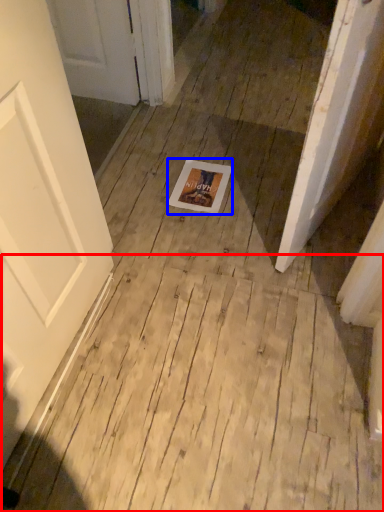
Question: Which of the following is the farthest to the observer, plywood (highlighted by a red box) or postcard (highlighted by a blue box)?

Choices:
 (A) plywood
 (B) postcard

Answer: (B)